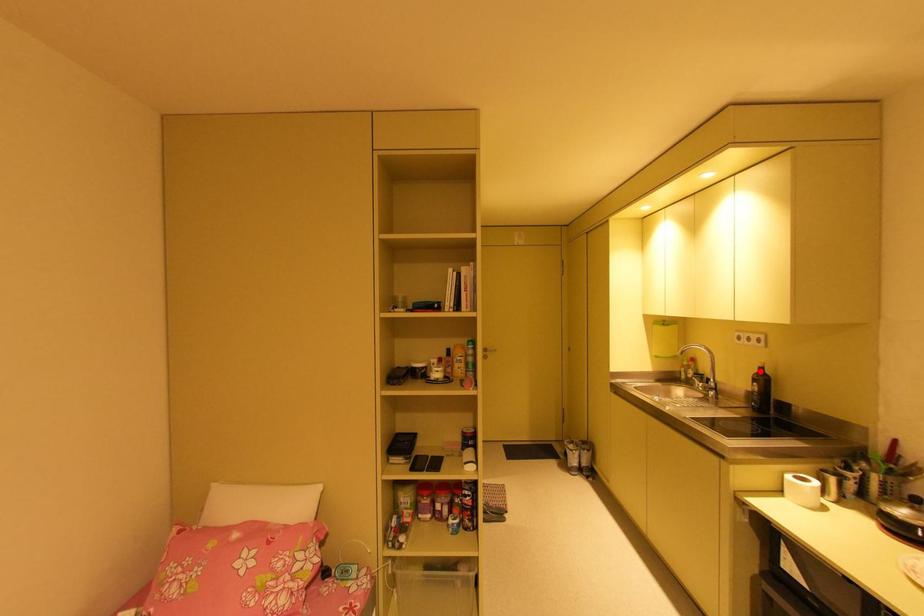
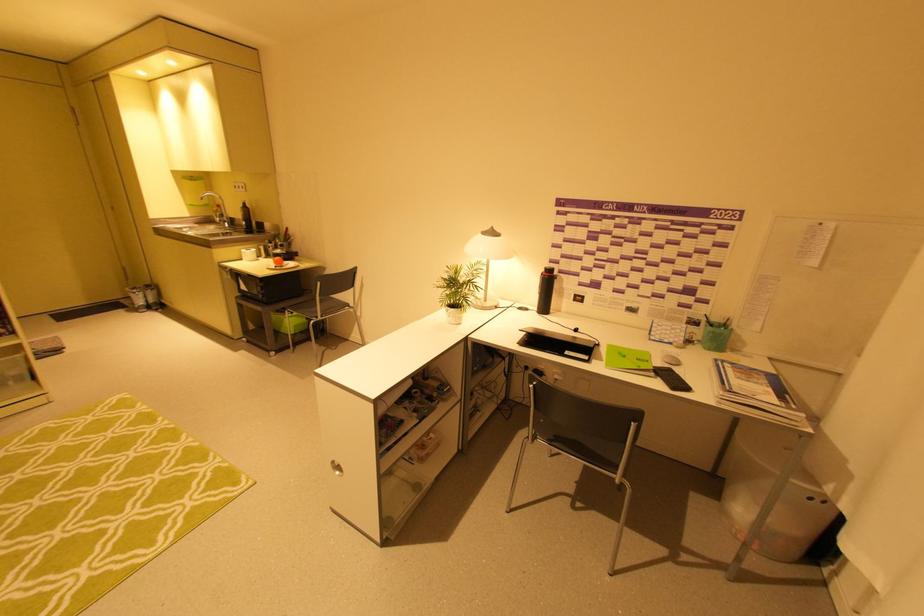
Where in the second image is the point corresponding to the highlighted location from the first image?

(246, 206)